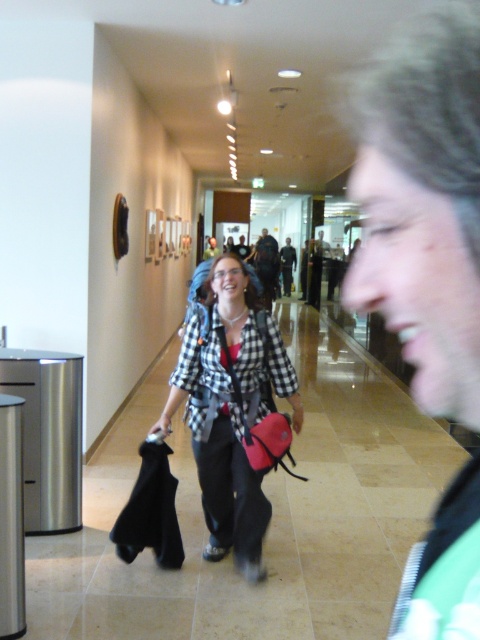
Does matte red bag at center appear on the right side of dark brown leather jacket at center?

No, matte red bag at center is not to the right of dark brown leather jacket at center.

Does matte red bag at center have a lesser width compared to dark brown leather jacket at center?

No.

Find the location of a particular element. matte red bag at center is located at coordinates (262, 428).

Which is more to the left, green fabric jacket at right or dark blue jeans at center?

green fabric jacket at right is more to the left.

At what (x,y) coordinates should I click in order to perform the action: click on green fabric jacket at right. Please return your answer as a coordinate pair (x, y). Image resolution: width=480 pixels, height=640 pixels. Looking at the image, I should click on (423, 209).

Between green fabric jacket at right and matte red bag at center, which one appears on the left side from the viewer's perspective?

matte red bag at center

Is point (476, 586) positioned before point (259, 314)?

Yes, it is in front of point (259, 314).

Describe the element at coordinates (423, 209) in the screenshot. I see `green fabric jacket at right` at that location.

The image size is (480, 640). Find the location of `green fabric jacket at right`. green fabric jacket at right is located at coordinates (423, 209).